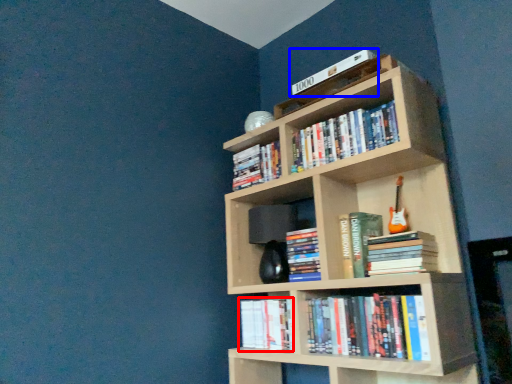
Question: Which object appears closest to the camera in this image, book (highlighted by a red box) or book (highlighted by a blue box)?

Choices:
 (A) book
 (B) book

Answer: (B)